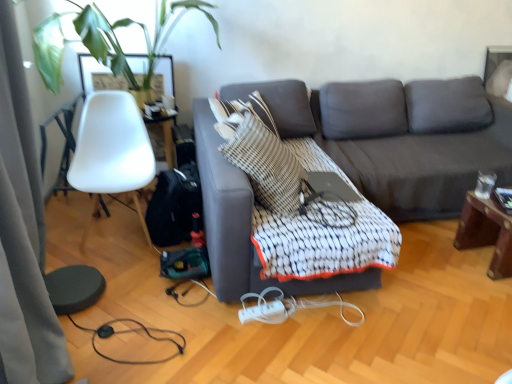
Where is `free region under white matte chair at left (from a real-world perspective)`? The image size is (512, 384). free region under white matte chair at left (from a real-world perspective) is located at coordinates (116, 236).